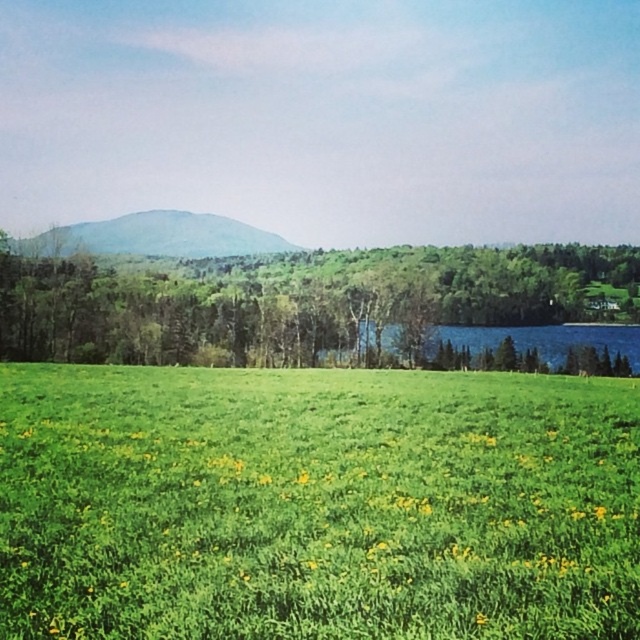
Who is lower down, green grassy field at center or green grassy hillside at upper center?

Positioned lower is green grassy field at center.

Does green grassy field at center lie in front of green grassy hillside at upper center?

That is True.

Does point (161, 596) lie behind point (291, 244)?

That is False.

Where is `green grassy field at center`? The width and height of the screenshot is (640, 640). green grassy field at center is located at coordinates (316, 504).

Is green leafy tree at center above green grassy hillside at upper center?

No.

Is point (216, 262) less distant than point (259, 250)?

Yes.

The image size is (640, 640). In order to click on green leafy tree at center in this screenshot , I will do `click(310, 304)`.

Is green grassy field at center to the left of green leafy tree at center from the viewer's perspective?

Yes, green grassy field at center is to the left of green leafy tree at center.

Between point (49, 454) and point (301, 301), which one is positioned behind?

Point (301, 301)

Is point (458, 570) positioned after point (556, 308)?

No.

The height and width of the screenshot is (640, 640). Find the location of `green grassy field at center`. green grassy field at center is located at coordinates (316, 504).